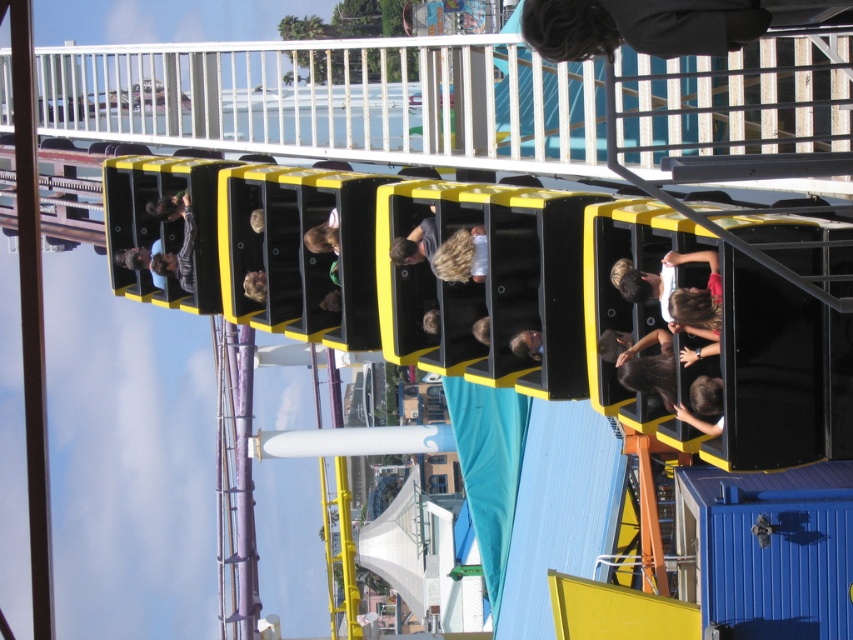
This screenshot has width=853, height=640. Describe the element at coordinates (640, 26) in the screenshot. I see `dark gray sweater at upper center` at that location.

This screenshot has height=640, width=853. Find the location of `dark gray sweater at upper center`. dark gray sweater at upper center is located at coordinates (640, 26).

Does point (669, 282) lie in front of point (517, 344)?

Yes, point (669, 282) is in front of point (517, 344).

Is point (692, 257) more distant than point (519, 356)?

No, (692, 257) is closer to viewer.

Locate an element on the screen. matte black hair at center is located at coordinates (670, 323).

Is point (698, 1) less distant than point (526, 340)?

Yes, point (698, 1) is in front of point (526, 340).

Which of these two, dark gray sweater at upper center or shiny brown hair at center, stands taller?

Standing taller between the two is shiny brown hair at center.

Does point (648, 29) lie behind point (519, 337)?

No, it is in front of (519, 337).

This screenshot has width=853, height=640. I want to click on dark gray sweater at upper center, so click(x=640, y=26).